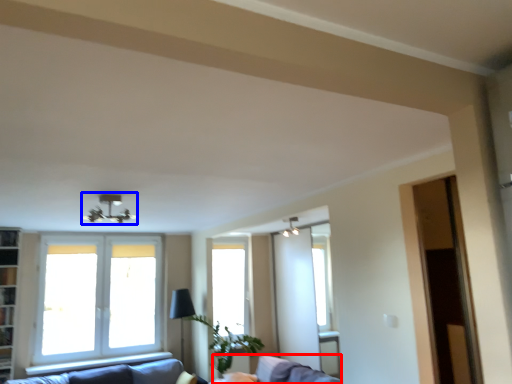
Question: Among these objects, which one is farthest to the camera, swivel chair (highlighted by a red box) or light fixture (highlighted by a blue box)?

Choices:
 (A) swivel chair
 (B) light fixture

Answer: (A)